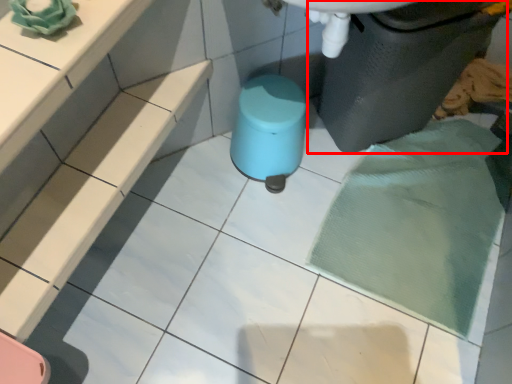
Question: Considering the relative positions of waste container (annotated by the red box) and stool in the image provided, where is waste container (annotated by the red box) located with respect to the staircase?

Choices:
 (A) left
 (B) right

Answer: (B)